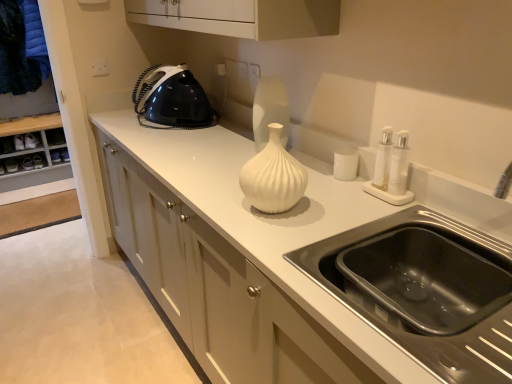
This screenshot has height=384, width=512. I want to click on free spot in front of white matte cup at center, so click(x=347, y=198).